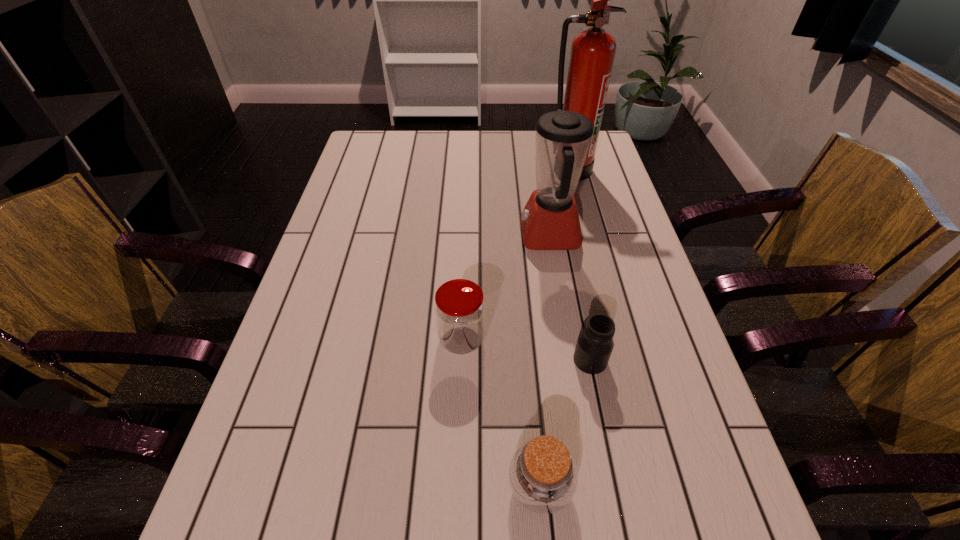
This screenshot has height=540, width=960. Find the location of `vacant space that satisfies the following two spatial constraints: 1. on the front of the second farthest object near the controls; 2. on the front side of the leftmost jar`. vacant space that satisfies the following two spatial constraints: 1. on the front of the second farthest object near the controls; 2. on the front side of the leftmost jar is located at coordinates (566, 340).